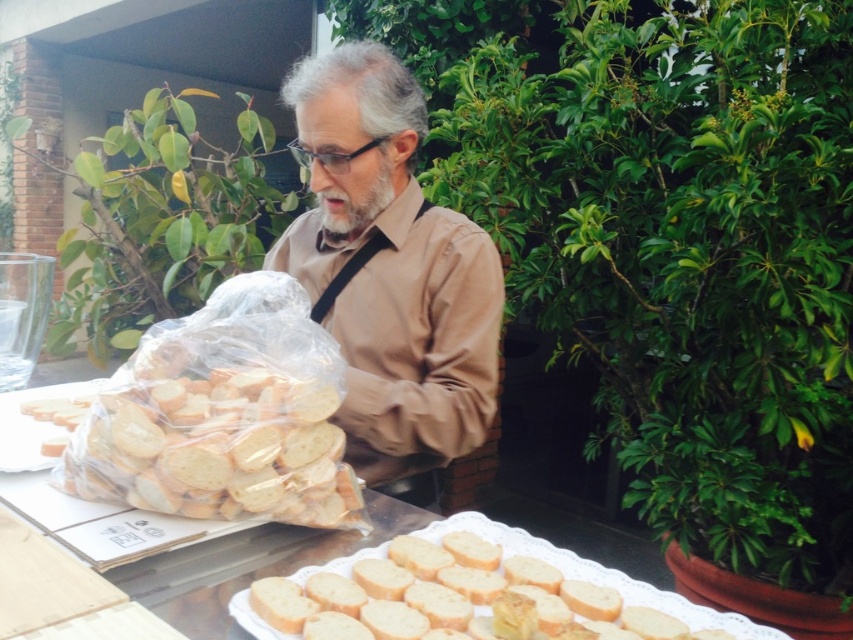
Where is the matte brown shirt at center located in the image?

The matte brown shirt at center is located at point coordinates of [389,268].

You are a customer at a bakery and see the matte brown shirt at center and the golden brown crusty bread at lower center on the table. Which item is positioned higher from the ground?

The matte brown shirt at center is above the golden brown crusty bread at lower center, so the matte brown shirt at center is higher from the ground.

You are a fashion designer observing the scene. You need to determine if the matte brown shirt at center can be worn over a jacket without looking too bulky. Considering the width of the golden brown crusty bread at lower center, can you estimate if the shirt is wider than the bread?

The matte brown shirt at center is wider than the golden brown crusty bread at lower center, so it can be worn over a jacket without looking too bulky since its width surpasses the bread.